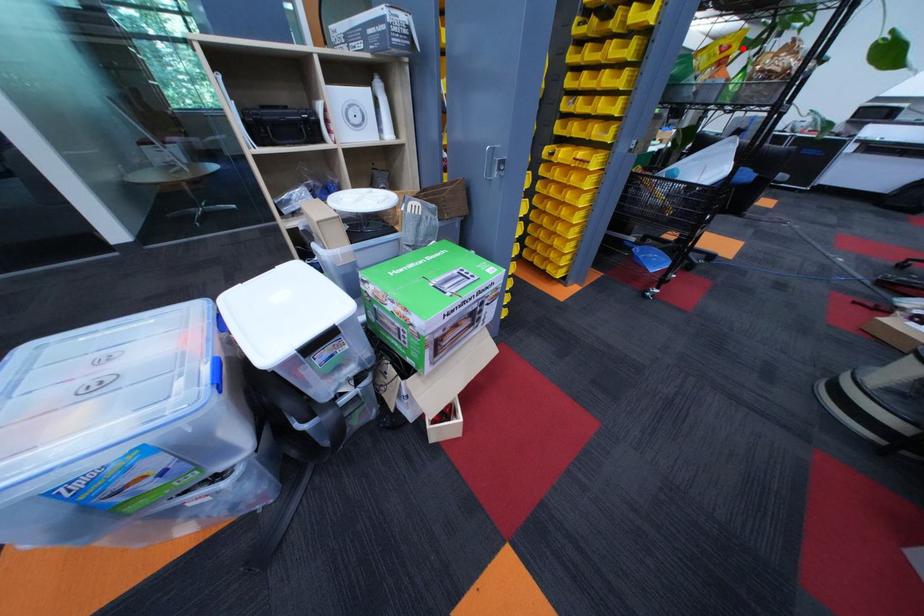
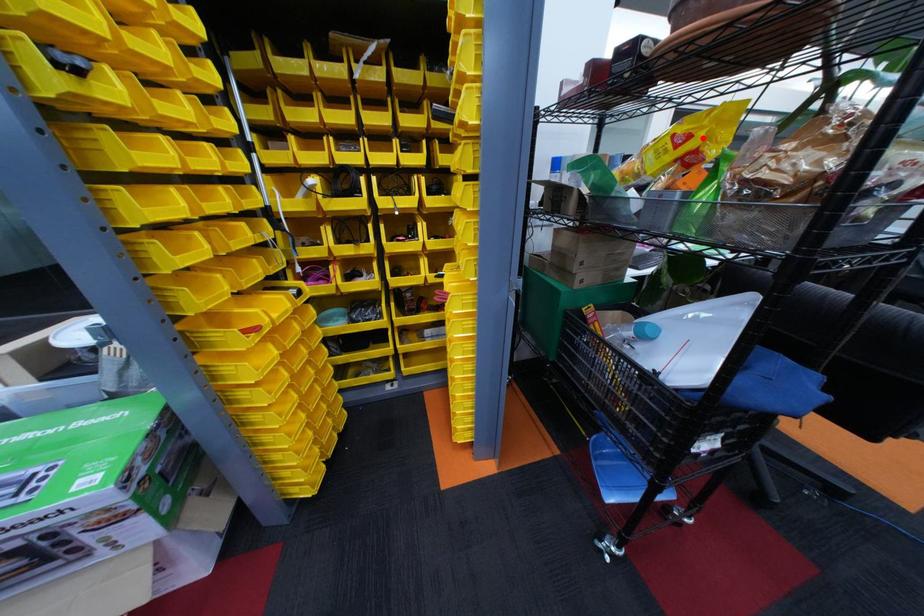
I am providing you with two images of the same scene from different viewpoints. A red point is marked on the first image and another point is marked on the second image. Do the highlighted points in image1 and image2 indicate the same real-world spot?

Yes